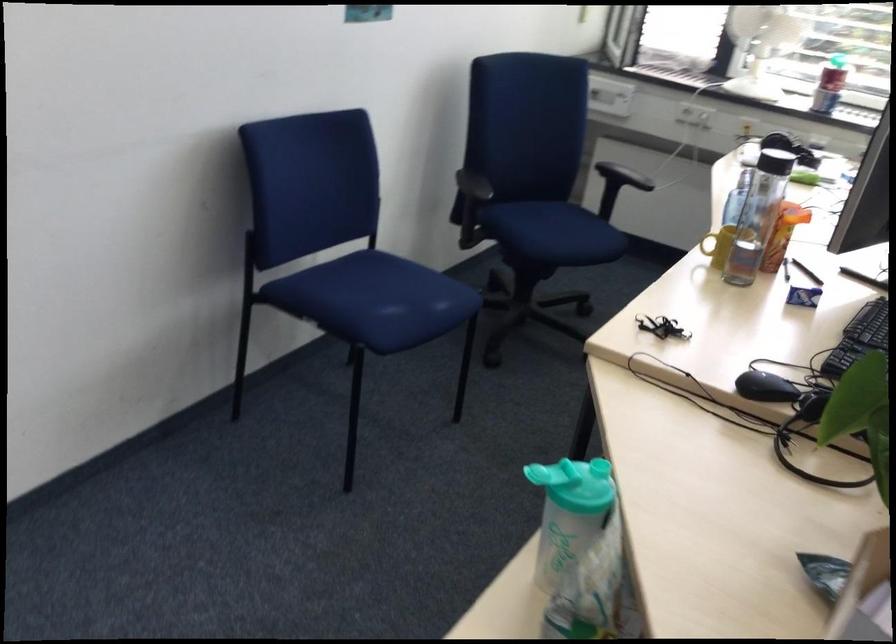
What do you see at coordinates (623, 176) in the screenshot?
I see `a black chair armrest` at bounding box center [623, 176].